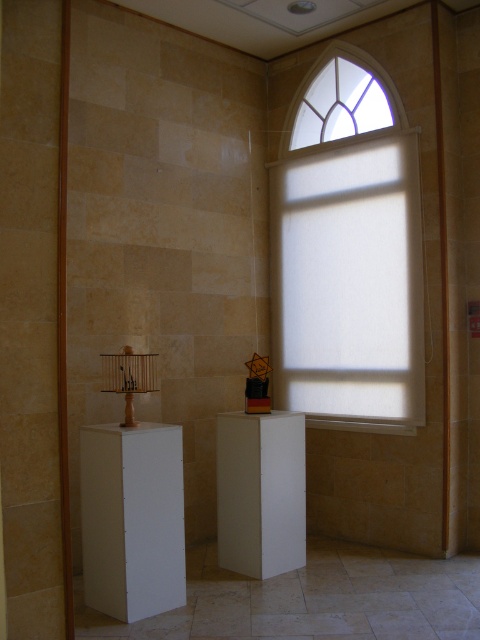
Question: Can you confirm if white matte window at upper center is thinner than white matte pedestal at left?

Choices:
 (A) yes
 (B) no

Answer: (B)

Question: Which point is closer to the camera?

Choices:
 (A) (324, 81)
 (B) (155, 563)

Answer: (B)

Question: Can you confirm if white matte pedestal at left is positioned below white matte pedestal at center?

Choices:
 (A) no
 (B) yes

Answer: (A)

Question: Based on their relative distances, which object is nearer to the clear glass window at upper center?

Choices:
 (A) white matte pedestal at left
 (B) white matte pedestal at center
 (C) white matte window at upper center

Answer: (C)

Question: Which object is farther from the camera taking this photo?

Choices:
 (A) white matte pedestal at left
 (B) white matte window at upper center
 (C) white matte pedestal at center
 (D) clear glass window at upper center

Answer: (D)

Question: Is white matte window at upper center to the left of clear glass window at upper center from the viewer's perspective?

Choices:
 (A) no
 (B) yes

Answer: (B)